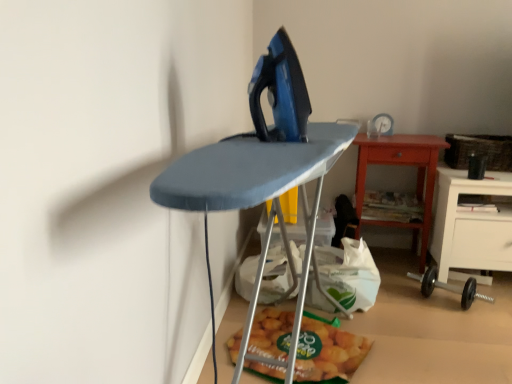
Image resolution: width=512 pixels, height=384 pixels. Find the location of `free point behind black rubber dumbbell at lower right`. free point behind black rubber dumbbell at lower right is located at coordinates (402, 274).